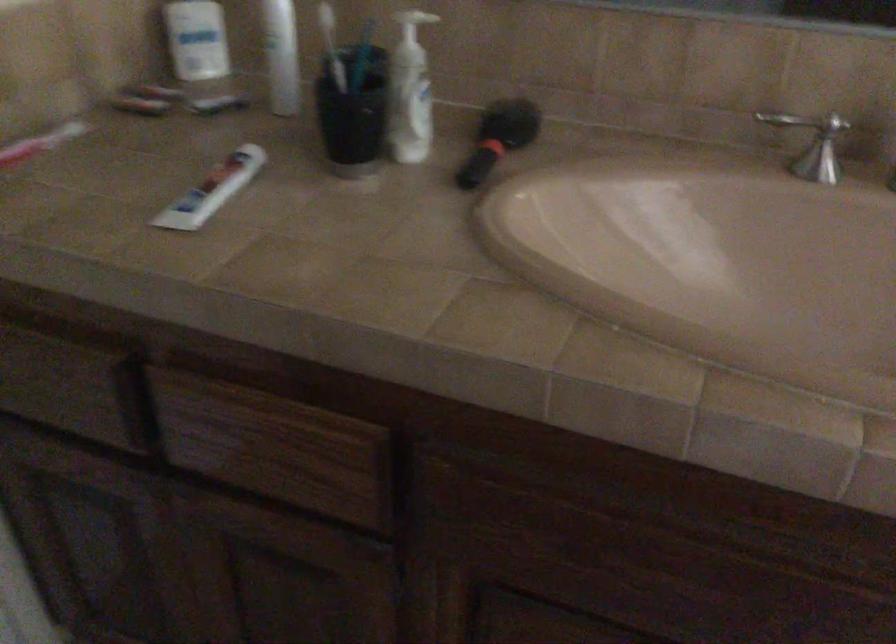
The height and width of the screenshot is (644, 896). Find the location of `black hairbrush`. black hairbrush is located at coordinates (498, 138).